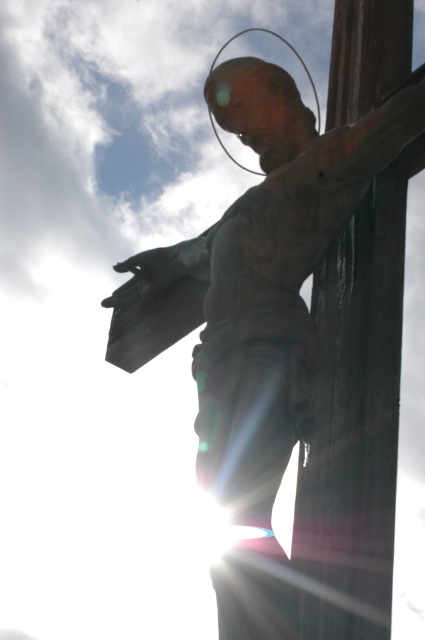
Question: Does bronze statue at center come behind wooden post at right?

Choices:
 (A) no
 (B) yes

Answer: (B)

Question: Is bronze statue at center positioned before wooden post at right?

Choices:
 (A) yes
 (B) no

Answer: (B)

Question: Observing the image, what is the correct spatial positioning of bronze statue at center in reference to wooden post at right?

Choices:
 (A) below
 (B) above

Answer: (A)

Question: Which point appears closest to the camera in this image?

Choices:
 (A) (108, 340)
 (B) (343, 560)

Answer: (B)

Question: Among these objects, which one is farthest from the camera?

Choices:
 (A) wooden post at right
 (B) bronze statue at center

Answer: (B)